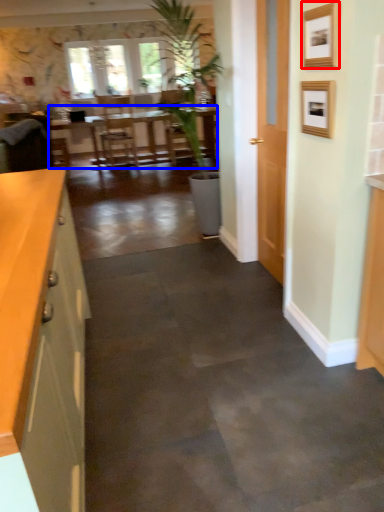
Question: Which of the following is the closest to the observer, picture frame (highlighted by a red box) or table (highlighted by a blue box)?

Choices:
 (A) picture frame
 (B) table

Answer: (A)